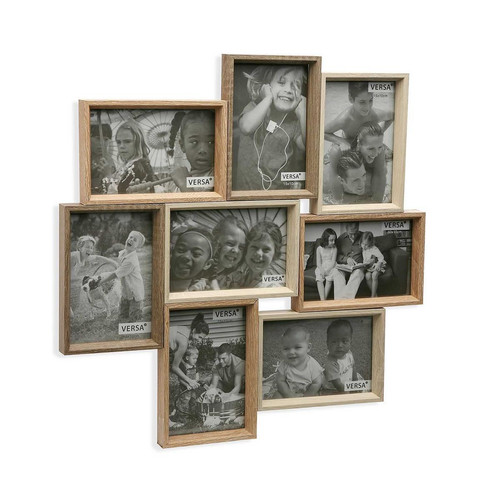
What are the coordinates of `picture frame` in the screenshot? It's located at (179, 142), (249, 128), (356, 142), (360, 251), (255, 237), (121, 276), (209, 328), (301, 350).